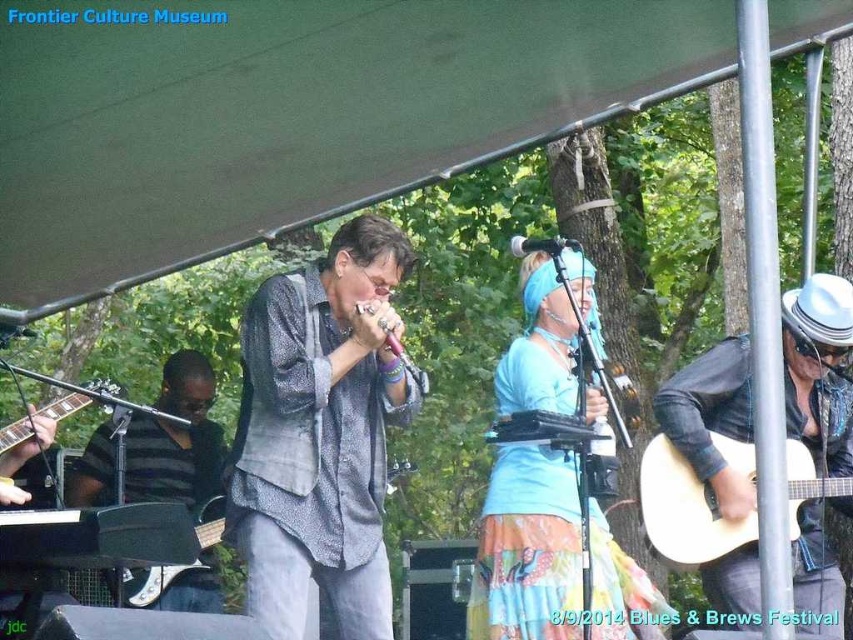
Question: Which of the following is the farthest from the observer?

Choices:
 (A) (154, 488)
 (B) (666, 444)
 (C) (270, 400)

Answer: (A)

Question: Can you confirm if blue fabric headband at center is positioned to the right of black matte guitar at left?

Choices:
 (A) yes
 (B) no

Answer: (A)

Question: Which point is farther from the camera taking this photo?

Choices:
 (A) (805, 608)
 (B) (28, 435)

Answer: (B)

Question: Which of the following is the closest to the observer?

Choices:
 (A) textured gray shirt at center
 (B) black leather jacket at right

Answer: (A)

Question: Can you confirm if black leather jacket at right is positioned to the left of black matte guitar at left?

Choices:
 (A) yes
 (B) no

Answer: (B)

Question: Can you confirm if blue fabric headband at center is bigger than acoustic wood guitar at right?

Choices:
 (A) yes
 (B) no

Answer: (A)